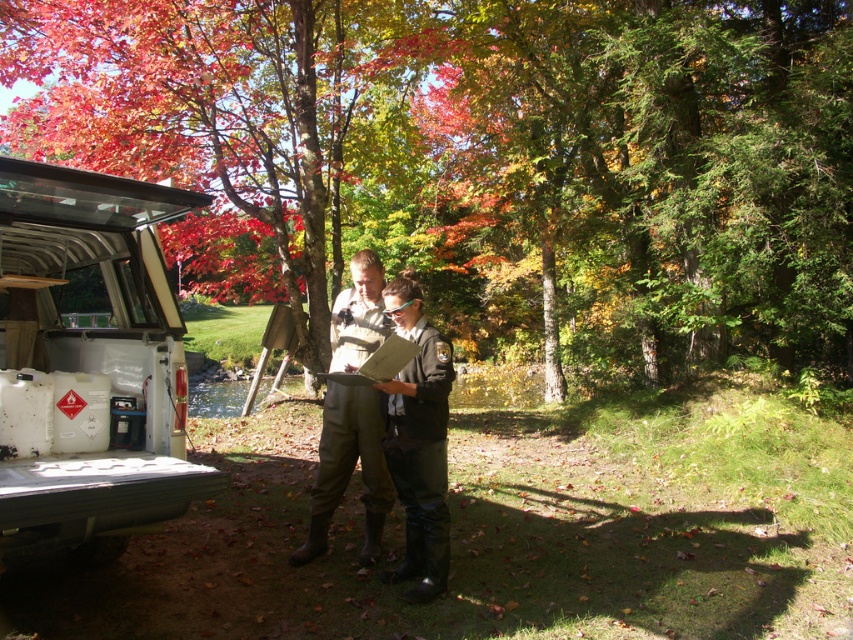
Question: Among these points, which one is nearest to the camera?

Choices:
 (A) (106, 483)
 (B) (422, 532)

Answer: (A)

Question: Which point is closer to the camera?

Choices:
 (A) black matte uniform at center
 (B) dark brown leather boots at center

Answer: (B)

Question: Can you confirm if green leafy tree at center is positioned below white plastic container at lower left?

Choices:
 (A) yes
 (B) no

Answer: (B)

Question: Does green leafy tree at center appear over dark brown leather boots at center?

Choices:
 (A) yes
 (B) no

Answer: (A)

Question: Can you confirm if white plastic container at lower left is bigger than black matte uniform at center?

Choices:
 (A) yes
 (B) no

Answer: (A)

Question: Which point appears closest to the camera in this image?

Choices:
 (A) (26, 36)
 (B) (115, 477)
 (C) (328, 380)

Answer: (B)